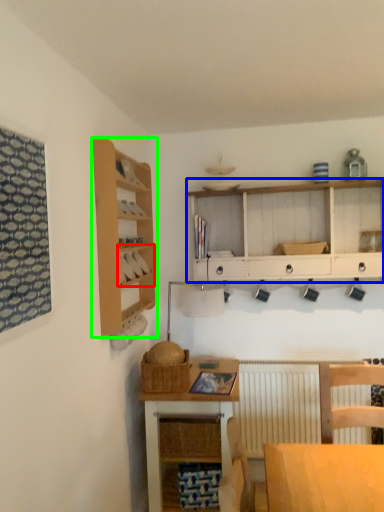
Question: Which object is the closest to the cabinet (highlighted by a red box)? Choose among these: cabinetry (highlighted by a blue box) or shelf (highlighted by a green box).

Choices:
 (A) cabinetry
 (B) shelf

Answer: (B)